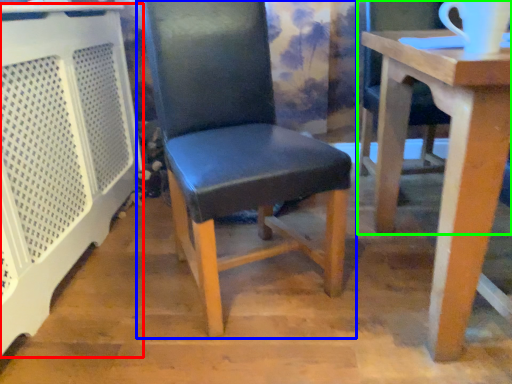
Question: Considering the real-world distances, which object is closest to cage (highlighted by a red box)? chair (highlighted by a blue box) or chair (highlighted by a green box).

Choices:
 (A) chair
 (B) chair

Answer: (A)